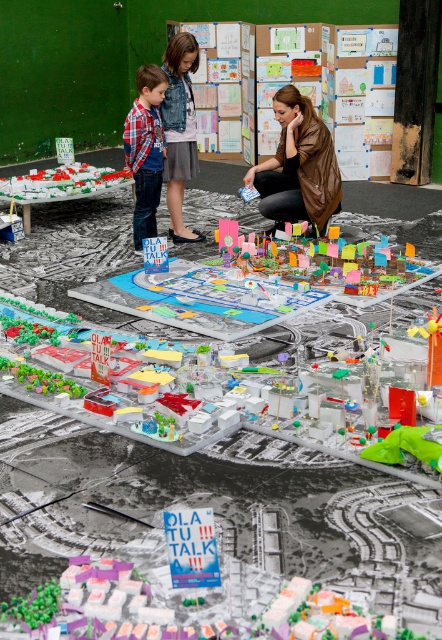
Please describe the location of the point marked at coordinates [298,164] in the image. Which object is it located on?

The point marked at coordinates [298,164] is located on the brown leather jacket at center.

You are standing in the room with the city model and the brown leather jacket at center. You want to pick up the jacket without stepping on the model. Can you reach it from your current position?

The brown leather jacket at center is 5.34 meters away from you, so you can reach it without stepping on the model if you extend your arm fully, but it might be a bit challenging due to the distance.